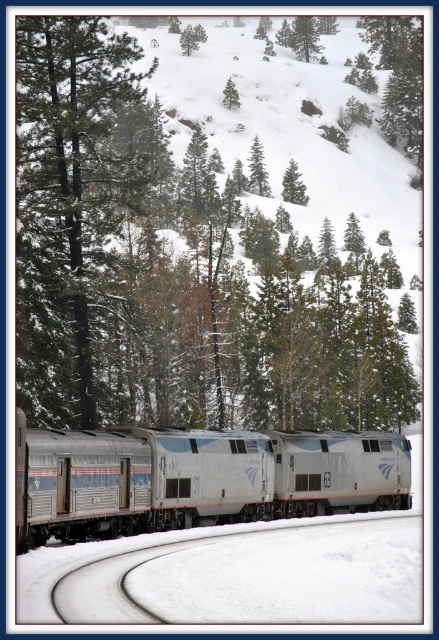
Is green matte tree at center closer to the viewer compared to silver metallic train at center?

No, green matte tree at center is further to the viewer.

Between point (57, 234) and point (349, 474), which one is positioned behind?

Positioned behind is point (349, 474).

This screenshot has height=640, width=439. Identify the location of green matte tree at center. [x=216, y=224].

Does green matte tree at center have a greater width compared to smooth dark green tree at left?

Yes.

Who is lower down, green matte tree at center or smooth dark green tree at left?

smooth dark green tree at left is below.

What do you see at coordinates (216, 224) in the screenshot? I see `green matte tree at center` at bounding box center [216, 224].

Identify the location of green matte tree at center. The image size is (439, 640). (216, 224).

Between smooth dark green tree at left and silver metallic train at center, which one is positioned lower?

silver metallic train at center is lower down.

Between point (125, 52) and point (125, 509), which one is positioned in front?

Point (125, 509) is in front.

Is point (135, 154) closer to camera compared to point (360, 465)?

No, (135, 154) is behind (360, 465).

Identify the location of smooth dark green tree at left. The height and width of the screenshot is (640, 439). click(71, 205).